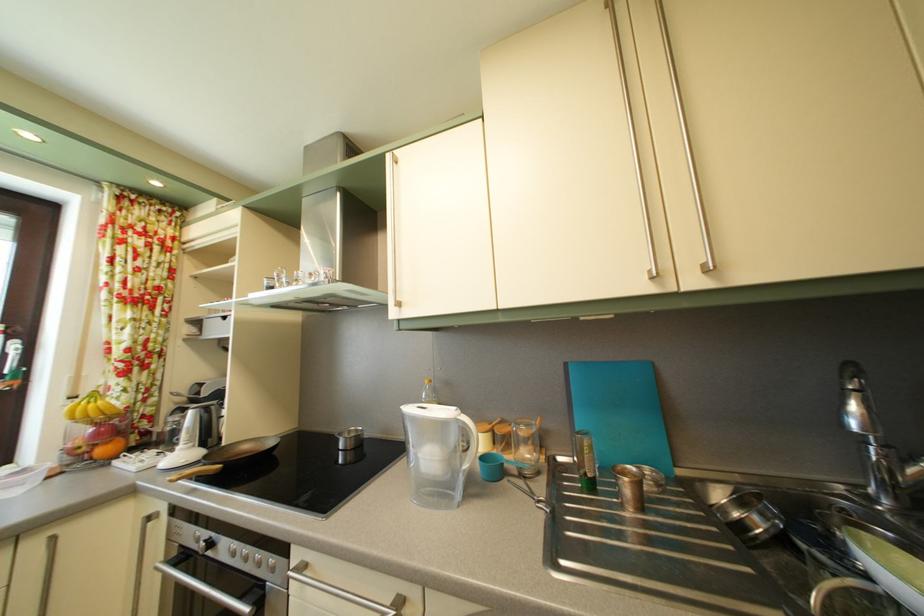
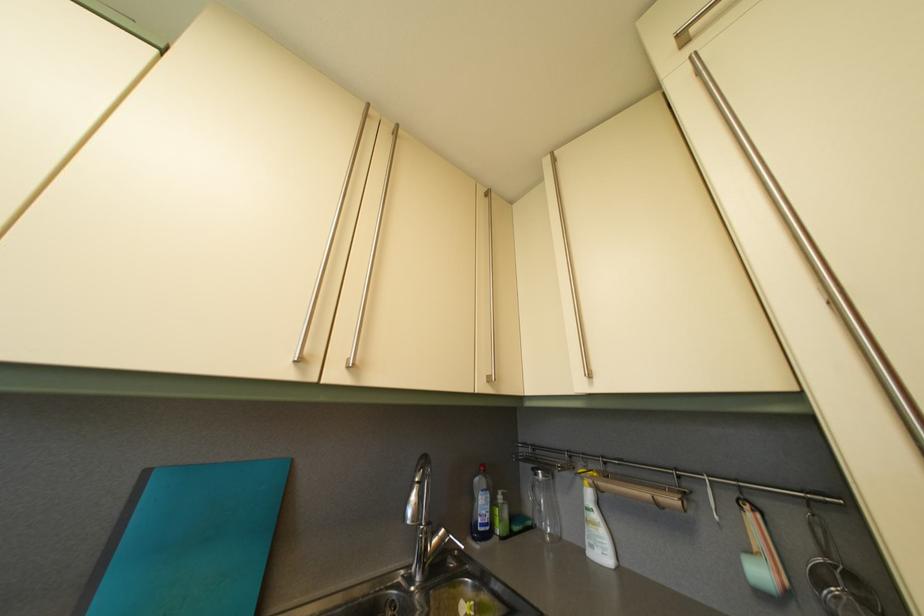
Find the pixel in the second image that matches [574,371] in the first image.

(154, 480)